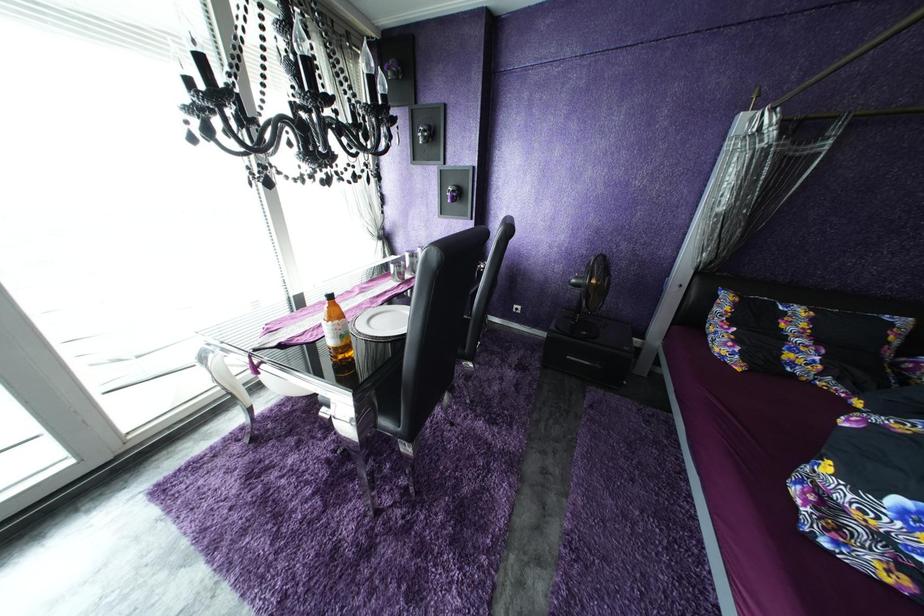
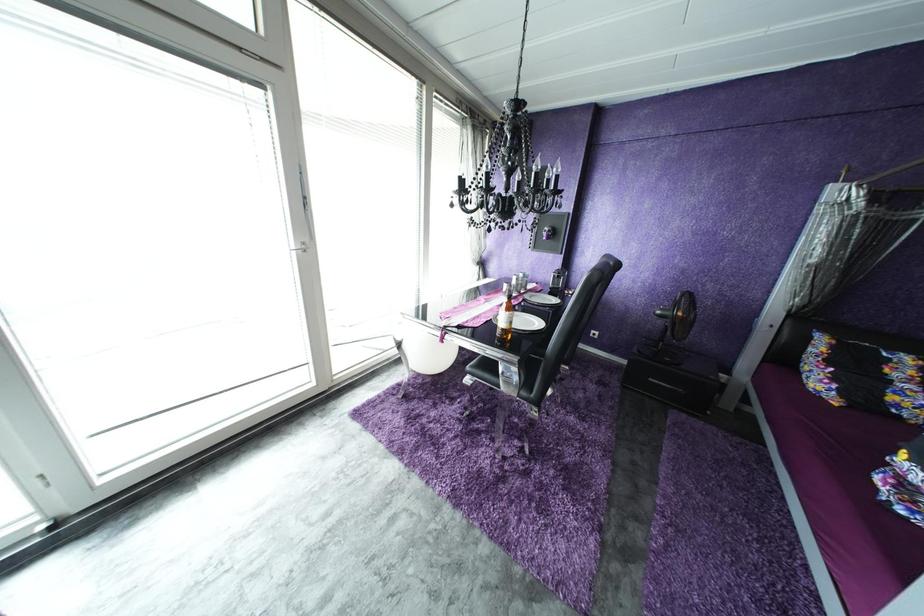
Question: The camera is either moving clockwise (left) or counter-clockwise (right) around the object. The first image is from the beginning of the video and the second image is from the end. Is the camera moving left or right when shooting the video?

Choices:
 (A) Left
 (B) Right

Answer: (B)